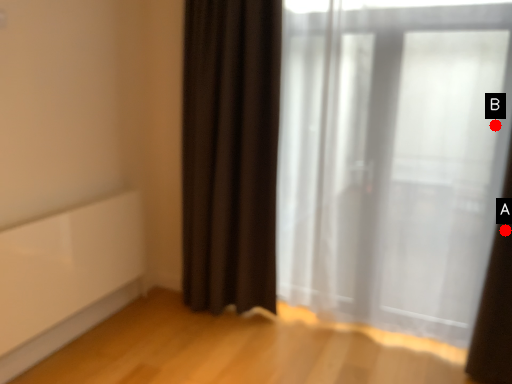
Question: Two points are circled on the image, labeled by A and B beside each circle. Which point appears closest to the camera in this image?

Choices:
 (A) A is closer
 (B) B is closer

Answer: (B)